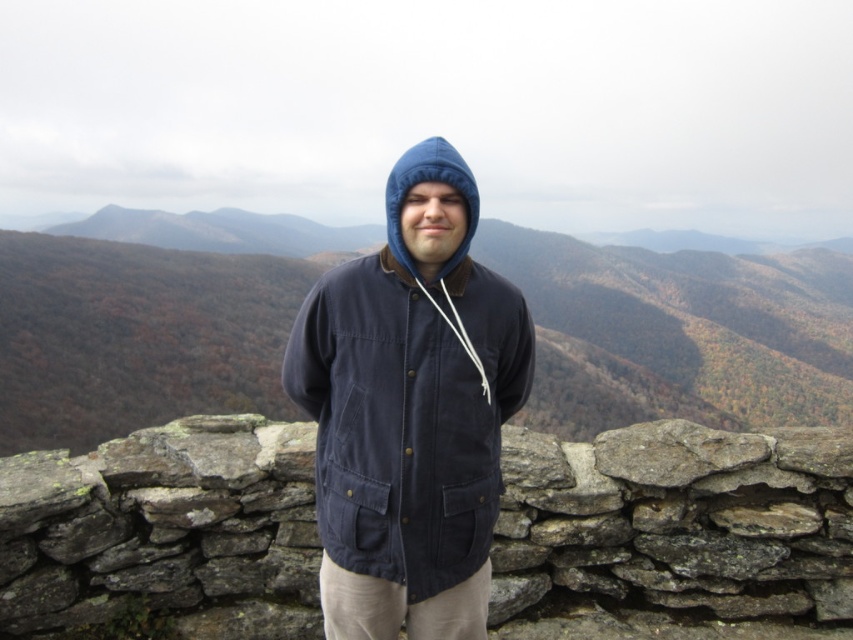
Question: Can you confirm if brown textured stone wall at center is wider than navy corduroy jacket at center?

Choices:
 (A) no
 (B) yes

Answer: (B)

Question: Which of the following is the farthest from the observer?

Choices:
 (A) gray stone wall at center
 (B) brown textured stone wall at center

Answer: (B)

Question: Which point is closer to the camera taking this photo?

Choices:
 (A) (9, 592)
 (B) (67, 304)
 (C) (404, 413)

Answer: (C)

Question: Which point is closer to the camera?

Choices:
 (A) (x=51, y=241)
 (B) (x=782, y=564)
 (C) (x=383, y=540)

Answer: (C)

Question: Does gray stone wall at center appear over brown textured stone wall at center?

Choices:
 (A) no
 (B) yes

Answer: (A)

Question: Does gray stone wall at center appear under navy corduroy jacket at center?

Choices:
 (A) no
 (B) yes

Answer: (B)